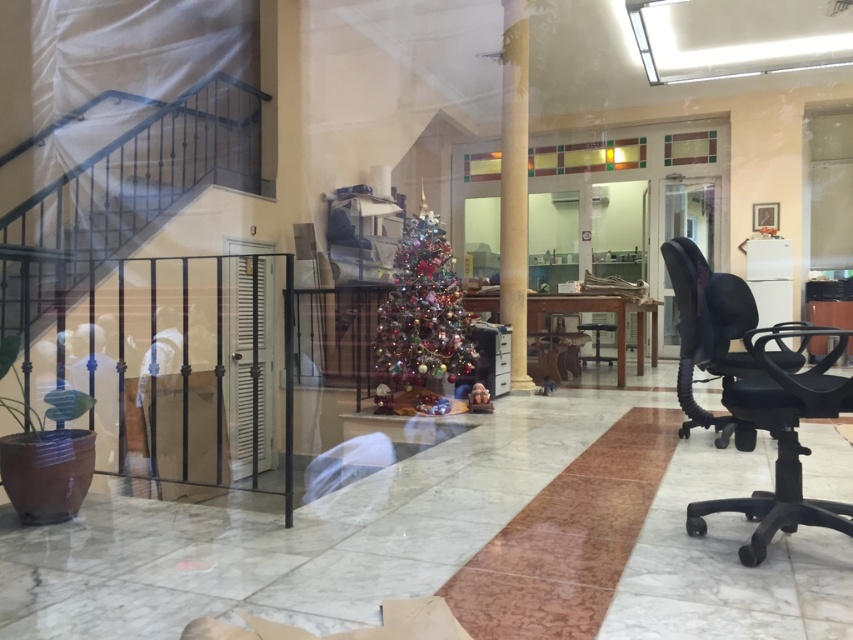
Question: Which of these objects is positioned closest to the shiny metallic christmas tree at center?

Choices:
 (A) white marble pillar at center
 (B) black matte swivel chair at right

Answer: (A)

Question: Does shiny metallic christmas tree at center have a lesser width compared to white marble pillar at center?

Choices:
 (A) yes
 (B) no

Answer: (B)

Question: Which is farther from the black matte swivel chair at right?

Choices:
 (A) white marble pillar at center
 (B) shiny metallic christmas tree at center

Answer: (A)

Question: Does black matte swivel chair at right appear on the left side of shiny metallic christmas tree at center?

Choices:
 (A) no
 (B) yes

Answer: (A)

Question: In this image, where is black matte swivel chair at right located relative to white marble pillar at center?

Choices:
 (A) below
 (B) above

Answer: (A)

Question: Considering the real-world distances, which object is farthest from the black matte swivel chair at right?

Choices:
 (A) shiny metallic christmas tree at center
 (B) white marble pillar at center

Answer: (B)